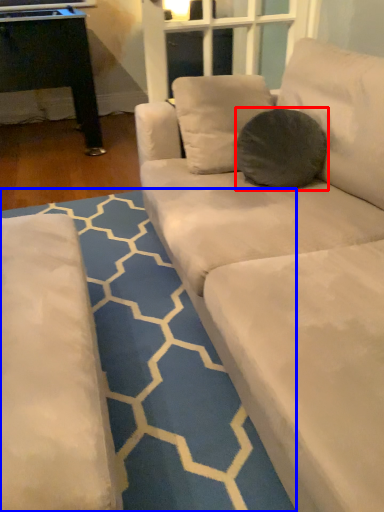
Question: Which point is closer to the camera, throw pillow (highlighted by a red box) or pattern (highlighted by a blue box)?

Choices:
 (A) throw pillow
 (B) pattern

Answer: (B)